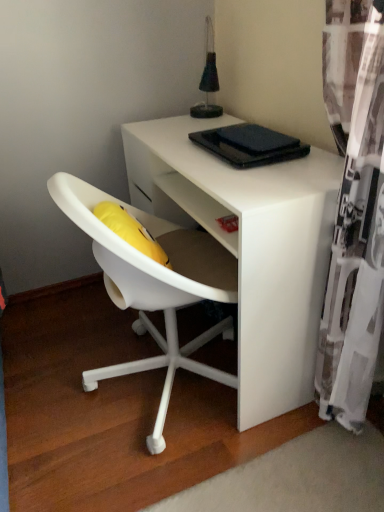
I want to click on white sheer curtain at right, so click(354, 211).

Looking at this image, does black matte pad at upper center come behind white sheer curtain at right?

Yes, black matte pad at upper center is further from the viewer.

Which is in front, point (218, 133) or point (373, 62)?

Point (373, 62)

Is black matte pad at upper center oriented towards white sheer curtain at right?

No, black matte pad at upper center is not oriented towards white sheer curtain at right.

Considering the relative sizes of black matte pad at upper center and white sheer curtain at right in the image provided, is black matte pad at upper center shorter than white sheer curtain at right?

Yes, black matte pad at upper center is shorter than white sheer curtain at right.

Where is `pad positioned vertically above the white sheer curtain at right (from a real-world perspective)`? The width and height of the screenshot is (384, 512). pad positioned vertically above the white sheer curtain at right (from a real-world perspective) is located at coordinates (256, 139).

In the image, is white sheer curtain at right positioned in front of or behind black matte pad at upper center?

white sheer curtain at right is positioned closer to the viewer than black matte pad at upper center.

Is point (336, 13) less distant than point (238, 141)?

Yes, it is.

Does white sheer curtain at right have a lesser height compared to black matte pad at upper center?

In fact, white sheer curtain at right may be taller than black matte pad at upper center.

Is white matte desk at center spatially inside white sheer curtain at right, or outside of it?

The correct answer is: outside.

Is white matte desk at center shorter than white sheer curtain at right?

Yes, white matte desk at center is shorter than white sheer curtain at right.

From the image's perspective, who appears lower, white matte desk at center or white sheer curtain at right?

white sheer curtain at right appears lower in the image.

From a real-world perspective, who is located lower, white matte desk at center or white sheer curtain at right?

In real-world perspective, white matte desk at center is lower.

Considering the relative sizes of black matte pad at upper center and white matte desk at center in the image provided, is black matte pad at upper center bigger than white matte desk at center?

Actually, black matte pad at upper center might be smaller than white matte desk at center.

Would you consider black matte pad at upper center to be distant from white matte desk at center?

No, black matte pad at upper center is in close proximity to white matte desk at center.

Is the position of black matte pad at upper center less distant than that of white matte desk at center?

No, black matte pad at upper center is further to the viewer.

Is white matte desk at center positioned before black matte pad at upper center?

Yes, white matte desk at center is closer to the viewer.

Is white matte desk at center oriented towards black matte pad at upper center?

No, white matte desk at center is not aimed at black matte pad at upper center.

Which is behind, point (241, 205) or point (220, 128)?

The point (220, 128) is farther from the camera.

From a real-world perspective, is white matte desk at center located higher than black matte pad at upper center?

No, from a real-world perspective, white matte desk at center is not above black matte pad at upper center.

Which is more to the right, white sheer curtain at right or white matte desk at center?

white sheer curtain at right is more to the right.

Can you confirm if white sheer curtain at right is wider than white matte desk at center?

In fact, white sheer curtain at right might be narrower than white matte desk at center.

From a real-world perspective, is white sheer curtain at right positioned above or below white matte desk at center?

Clearly, from a real-world perspective, white sheer curtain at right is above white matte desk at center.

Locate an element on the screen. curtain on the right of black matte pad at upper center is located at coordinates (354, 211).

This screenshot has height=512, width=384. In order to click on pad located above the white sheer curtain at right (from a real-world perspective) in this screenshot , I will do `click(256, 139)`.

When comparing their distances from white sheer curtain at right, does white matte desk at center or black matte pad at upper center seem further?

Among the two, black matte pad at upper center is located further to white sheer curtain at right.

Looking at the image, which one is located closer to white sheer curtain at right, black matte pad at upper center or white matte desk at center?

white matte desk at center is closer to white sheer curtain at right.

Based on their spatial positions, is black matte pad at upper center or white sheer curtain at right further from white matte desk at center?

Based on the image, black matte pad at upper center appears to be further to white matte desk at center.

From the image, which object appears to be nearer to black matte pad at upper center, white sheer curtain at right or white matte desk at center?

white matte desk at center.

From the image, which object appears to be farther from white matte desk at center, white sheer curtain at right or black matte pad at upper center?

black matte pad at upper center is positioned further to the anchor white matte desk at center.

When comparing their distances from black matte pad at upper center, does white matte desk at center or white sheer curtain at right seem further?

white sheer curtain at right.

You are a GUI agent. You are given a task and a screenshot of the screen. Output one action in this format:
    pyautogui.click(x=<x>, y=<y>)
    Task: Click on the desk between white sheer curtain at right and black matte pad at upper center in the front-back direction
    Image resolution: width=384 pixels, height=512 pixels.
    Given the screenshot: What is the action you would take?
    pyautogui.click(x=250, y=247)